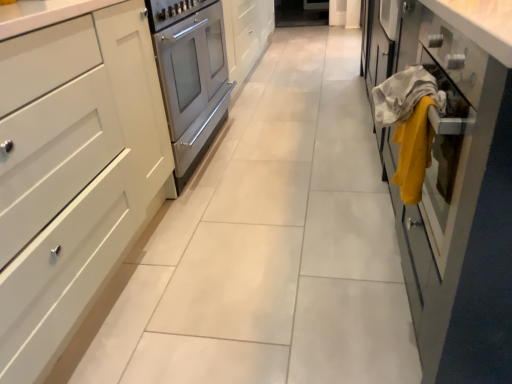
What is the approximate height of yellow fabric at right, the second blanket from the left?

It is 9.04 inches.

Where is `white matte cabinet at left, which is the second cabinetry from right to left`? The width and height of the screenshot is (512, 384). white matte cabinet at left, which is the second cabinetry from right to left is located at coordinates (72, 172).

I want to click on yellow fabric at right, marked as the 1th blanket in a left-to-right arrangement, so click(x=405, y=95).

In the scene shown: Would you say yellow fabric at right, positioned as the 2th blanket in right-to-left order, is part of white matte cabinet at left, marked as the 1th cabinetry in a left-to-right arrangement,'s contents?

No, white matte cabinet at left, marked as the 1th cabinetry in a left-to-right arrangement, does not contain yellow fabric at right, positioned as the 2th blanket in right-to-left order.

Between white matte cabinet at left, marked as the 1th cabinetry in a left-to-right arrangement, and yellow fabric at right, marked as the 1th blanket in a left-to-right arrangement, which one has less height?

With less height is yellow fabric at right, marked as the 1th blanket in a left-to-right arrangement.

Does white matte cabinet at left, which is the second cabinetry from right to left, appear on the left side of yellow fabric at right, positioned as the 2th blanket in right-to-left order?

Indeed, white matte cabinet at left, which is the second cabinetry from right to left, is positioned on the left side of yellow fabric at right, positioned as the 2th blanket in right-to-left order.

From the image's perspective, is white matte cabinet at left, marked as the 1th cabinetry in a left-to-right arrangement, located above yellow fabric at right, marked as the 1th blanket in a left-to-right arrangement?

No, from the image's perspective, white matte cabinet at left, marked as the 1th cabinetry in a left-to-right arrangement, is not over yellow fabric at right, marked as the 1th blanket in a left-to-right arrangement.

Considering the relative sizes of yellow fabric at right, the second blanket from the left, and white matte cabinet at left, which is the second cabinetry from right to left, in the image provided, is yellow fabric at right, the second blanket from the left, taller than white matte cabinet at left, which is the second cabinetry from right to left,?

Incorrect, the height of yellow fabric at right, the second blanket from the left, is not larger of that of white matte cabinet at left, which is the second cabinetry from right to left.

Would you say yellow fabric at right, the 1th blanket when ordered from right to left, is inside or outside white matte cabinet at left, which is the second cabinetry from right to left?

yellow fabric at right, the 1th blanket when ordered from right to left, is outside white matte cabinet at left, which is the second cabinetry from right to left.

Considering the sizes of objects yellow fabric at right, the 1th blanket when ordered from right to left, and white matte cabinet at left, marked as the 1th cabinetry in a left-to-right arrangement, in the image provided, who is wider, yellow fabric at right, the 1th blanket when ordered from right to left, or white matte cabinet at left, marked as the 1th cabinetry in a left-to-right arrangement,?

Wider between the two is white matte cabinet at left, marked as the 1th cabinetry in a left-to-right arrangement.

Measure the distance between yellow fabric at right, the second blanket from the left, and white matte cabinet at left, which is the second cabinetry from right to left.

yellow fabric at right, the second blanket from the left, and white matte cabinet at left, which is the second cabinetry from right to left, are 89.03 centimeters apart from each other.

Considering the relative sizes of matte glass cabinet at right, placed as the 1th cabinetry when sorted from right to left, and yellow fabric at right, positioned as the 2th blanket in right-to-left order, in the image provided, is matte glass cabinet at right, placed as the 1th cabinetry when sorted from right to left, taller than yellow fabric at right, positioned as the 2th blanket in right-to-left order,?

Correct, matte glass cabinet at right, placed as the 1th cabinetry when sorted from right to left, is much taller as yellow fabric at right, positioned as the 2th blanket in right-to-left order.

Can you confirm if matte glass cabinet at right, the second cabinetry when ordered from left to right, is thinner than yellow fabric at right, positioned as the 2th blanket in right-to-left order?

In fact, matte glass cabinet at right, the second cabinetry when ordered from left to right, might be wider than yellow fabric at right, positioned as the 2th blanket in right-to-left order.

Considering the sizes of matte glass cabinet at right, the second cabinetry when ordered from left to right, and yellow fabric at right, positioned as the 2th blanket in right-to-left order, in the image, is matte glass cabinet at right, the second cabinetry when ordered from left to right, bigger or smaller than yellow fabric at right, positioned as the 2th blanket in right-to-left order,?

In the image, matte glass cabinet at right, the second cabinetry when ordered from left to right, appears to be larger than yellow fabric at right, positioned as the 2th blanket in right-to-left order.

From the matte glass cabinet at right, the second cabinetry when ordered from left to right, count 1st blankets backward and point to it. Please provide its 2D coordinates.

[(405, 95)]

From a real-world perspective, is yellow fabric at right, the 1th blanket when ordered from right to left, positioned above or below matte glass cabinet at right, placed as the 1th cabinetry when sorted from right to left?

In terms of real-world spatial position, yellow fabric at right, the 1th blanket when ordered from right to left, is below matte glass cabinet at right, placed as the 1th cabinetry when sorted from right to left.

Is yellow fabric at right, the second blanket from the left, to the left of matte glass cabinet at right, placed as the 1th cabinetry when sorted from right to left, from the viewer's perspective?

Yes.

Considering the positions of points (415, 136) and (477, 78), is point (415, 136) farther from camera compared to point (477, 78)?

Yes, it is.

Consider the image. Can you tell me how much yellow fabric at right, the 1th blanket when ordered from right to left, and matte glass cabinet at right, the second cabinetry when ordered from left to right, differ in facing direction?

The angle between the facing direction of yellow fabric at right, the 1th blanket when ordered from right to left, and the facing direction of matte glass cabinet at right, the second cabinetry when ordered from left to right, is 1.9 degrees.

Does point (394, 90) come behind point (2, 245)?

Yes, it is.

The height and width of the screenshot is (384, 512). Identify the location of the 2nd blanket directly above the white matte cabinet at left, which is the second cabinetry from right to left (from a real-world perspective). (405, 95).

Is yellow fabric at right, marked as the 1th blanket in a left-to-right arrangement, closer to the viewer compared to white matte cabinet at left, which is the second cabinetry from right to left?

No, it is behind white matte cabinet at left, which is the second cabinetry from right to left.

Is yellow fabric at right, positioned as the 2th blanket in right-to-left order, located outside white matte cabinet at left, marked as the 1th cabinetry in a left-to-right arrangement?

yellow fabric at right, positioned as the 2th blanket in right-to-left order, is positioned outside white matte cabinet at left, marked as the 1th cabinetry in a left-to-right arrangement.

Could you measure the distance between white matte cabinet at left, which is the second cabinetry from right to left, and yellow fabric at right, the second blanket from the left?

The distance of white matte cabinet at left, which is the second cabinetry from right to left, from yellow fabric at right, the second blanket from the left, is 89.03 centimeters.

From the image's perspective, is white matte cabinet at left, which is the second cabinetry from right to left, under yellow fabric at right, the 1th blanket when ordered from right to left?

Yes.

Is white matte cabinet at left, which is the second cabinetry from right to left, at the left side of yellow fabric at right, the second blanket from the left?

Indeed, white matte cabinet at left, which is the second cabinetry from right to left, is positioned on the left side of yellow fabric at right, the second blanket from the left.

Who is more distant, white matte cabinet at left, marked as the 1th cabinetry in a left-to-right arrangement, or yellow fabric at right, the second blanket from the left?

yellow fabric at right, the second blanket from the left, is further from the camera.

Is yellow fabric at right, the second blanket from the left, shorter than yellow fabric at right, marked as the 1th blanket in a left-to-right arrangement?

Correct, yellow fabric at right, the second blanket from the left, is not as tall as yellow fabric at right, marked as the 1th blanket in a left-to-right arrangement.

Considering the relative positions of yellow fabric at right, the 1th blanket when ordered from right to left, and yellow fabric at right, positioned as the 2th blanket in right-to-left order, in the image provided, is yellow fabric at right, the 1th blanket when ordered from right to left, in front of yellow fabric at right, positioned as the 2th blanket in right-to-left order,?

No, it is not.

From the image's perspective, is yellow fabric at right, the second blanket from the left, over yellow fabric at right, positioned as the 2th blanket in right-to-left order?

No, from the image's perspective, yellow fabric at right, the second blanket from the left, is not over yellow fabric at right, positioned as the 2th blanket in right-to-left order.

Starting from the white matte cabinet at left, marked as the 1th cabinetry in a left-to-right arrangement, which blanket is the 1st one to the right? Please provide its 2D coordinates.

[(405, 95)]

Identify the location of cabinetry located underneath the yellow fabric at right, the 1th blanket when ordered from right to left (from a real-world perspective). (72, 172).

Which object lies further to the anchor point yellow fabric at right, the second blanket from the left, white matte cabinet at left, which is the second cabinetry from right to left, or matte glass cabinet at right, placed as the 1th cabinetry when sorted from right to left?

The object further to yellow fabric at right, the second blanket from the left, is white matte cabinet at left, which is the second cabinetry from right to left.

Estimate the real-world distances between objects in this image. Which object is closer to yellow fabric at right, marked as the 1th blanket in a left-to-right arrangement, matte glass cabinet at right, placed as the 1th cabinetry when sorted from right to left, or white matte cabinet at left, marked as the 1th cabinetry in a left-to-right arrangement?

matte glass cabinet at right, placed as the 1th cabinetry when sorted from right to left, is positioned closer to the anchor yellow fabric at right, marked as the 1th blanket in a left-to-right arrangement.

From the image, which object appears to be farther from matte glass cabinet at right, placed as the 1th cabinetry when sorted from right to left, white matte cabinet at left, marked as the 1th cabinetry in a left-to-right arrangement, or yellow fabric at right, the 1th blanket when ordered from right to left?

white matte cabinet at left, marked as the 1th cabinetry in a left-to-right arrangement, lies further to matte glass cabinet at right, placed as the 1th cabinetry when sorted from right to left, than the other object.

Based on their spatial positions, is matte glass cabinet at right, the second cabinetry when ordered from left to right, or yellow fabric at right, positioned as the 2th blanket in right-to-left order, closer to white matte cabinet at left, marked as the 1th cabinetry in a left-to-right arrangement?

Among the two, yellow fabric at right, positioned as the 2th blanket in right-to-left order, is located nearer to white matte cabinet at left, marked as the 1th cabinetry in a left-to-right arrangement.

Estimate the real-world distances between objects in this image. Which object is closer to white matte cabinet at left, which is the second cabinetry from right to left, yellow fabric at right, positioned as the 2th blanket in right-to-left order, or yellow fabric at right, the second blanket from the left?

Based on the image, yellow fabric at right, positioned as the 2th blanket in right-to-left order, appears to be nearer to white matte cabinet at left, which is the second cabinetry from right to left.

Considering their positions, is matte glass cabinet at right, the second cabinetry when ordered from left to right, positioned further to yellow fabric at right, the second blanket from the left, than yellow fabric at right, positioned as the 2th blanket in right-to-left order?

matte glass cabinet at right, the second cabinetry when ordered from left to right, is positioned further to the anchor yellow fabric at right, the second blanket from the left.

Looking at the image, which one is located closer to yellow fabric at right, the second blanket from the left, yellow fabric at right, marked as the 1th blanket in a left-to-right arrangement, or white matte cabinet at left, which is the second cabinetry from right to left?

Based on the image, yellow fabric at right, marked as the 1th blanket in a left-to-right arrangement, appears to be nearer to yellow fabric at right, the second blanket from the left.

Estimate the real-world distances between objects in this image. Which object is closer to yellow fabric at right, positioned as the 2th blanket in right-to-left order, matte glass cabinet at right, the second cabinetry when ordered from left to right, or yellow fabric at right, the second blanket from the left?

yellow fabric at right, the second blanket from the left, is positioned closer to the anchor yellow fabric at right, positioned as the 2th blanket in right-to-left order.

Where is `blanket situated between white matte cabinet at left, which is the second cabinetry from right to left, and yellow fabric at right, the second blanket from the left, from left to right`? blanket situated between white matte cabinet at left, which is the second cabinetry from right to left, and yellow fabric at right, the second blanket from the left, from left to right is located at coordinates (405, 95).

At what (x,y) coordinates should I click in order to perform the action: click on blanket between matte glass cabinet at right, placed as the 1th cabinetry when sorted from right to left, and yellow fabric at right, the 1th blanket when ordered from right to left, in the front-back direction. Please return your answer as a coordinate pair (x, y). Looking at the image, I should click on (405, 95).